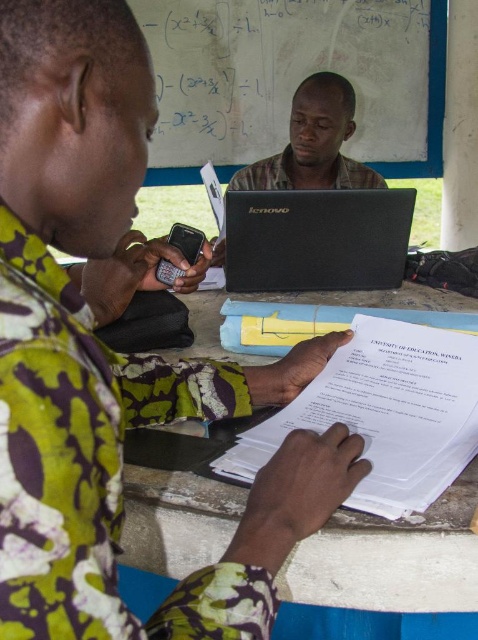
Is blue wood table at center to the left of black matte laptop at center from the viewer's perspective?

Yes, blue wood table at center is to the left of black matte laptop at center.

Find the location of a particular element. This screenshot has width=478, height=640. blue wood table at center is located at coordinates (391, 557).

This screenshot has width=478, height=640. I want to click on blue wood table at center, so click(391, 557).

Where is `white paper at center`? white paper at center is located at coordinates (384, 412).

Between white paper at center and black matte phone at left, which one has more height?

Standing taller between the two is white paper at center.

Locate an element on the screen. Image resolution: width=478 pixels, height=640 pixels. white paper at center is located at coordinates (384, 412).

You are a GUI agent. You are given a task and a screenshot of the screen. Output one action in this format:
    pyautogui.click(x=<x>, y=<y>)
    Task: Click on the white paper at center
    The width and height of the screenshot is (478, 640).
    Given the screenshot: What is the action you would take?
    pyautogui.click(x=384, y=412)

Find the location of a particular element. white matte whiteboard at upper center is located at coordinates (293, 77).